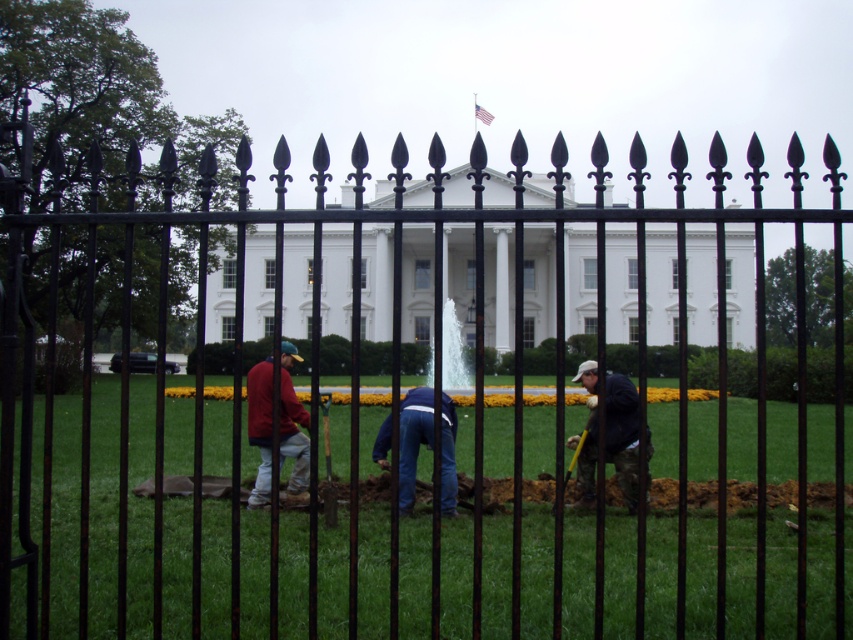
Question: Does camouflage pants at center appear on the left side of matte red shirt at center?

Choices:
 (A) no
 (B) yes

Answer: (A)

Question: Does blue jeans at center appear under yellow plastic shovel at center?

Choices:
 (A) yes
 (B) no

Answer: (B)

Question: Which point is closer to the camera?

Choices:
 (A) 253,376
 (B) 625,499

Answer: (B)

Question: Can you confirm if camouflage pants at center is smaller than blue jeans at center?

Choices:
 (A) no
 (B) yes

Answer: (A)

Question: Based on their relative distances, which object is farther from the camouflage pants at center?

Choices:
 (A) matte red shirt at center
 (B) yellow plastic shovel at center
 (C) blue jeans at center

Answer: (B)

Question: Based on their relative distances, which object is nearer to the yellow plastic shovel at center?

Choices:
 (A) matte red shirt at center
 (B) camouflage pants at center

Answer: (A)